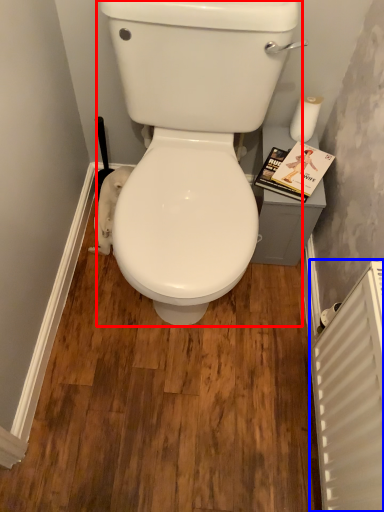
Question: Which object is closer to the camera taking this photo, porcelain (highlighted by a red box) or radiator (highlighted by a blue box)?

Choices:
 (A) porcelain
 (B) radiator

Answer: (B)